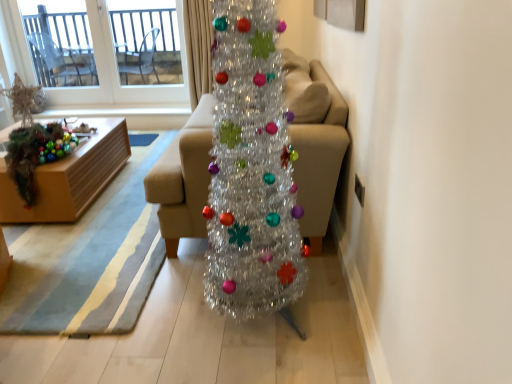
Question: From a real-world perspective, does transparent glass door at upper left sit lower than shiny metallic christmas tree at center?

Choices:
 (A) no
 (B) yes

Answer: (A)

Question: Is transparent glass door at upper left to the left of shiny metallic christmas tree at center from the viewer's perspective?

Choices:
 (A) yes
 (B) no

Answer: (A)

Question: Can you confirm if transparent glass door at upper left is wider than shiny metallic christmas tree at center?

Choices:
 (A) yes
 (B) no

Answer: (B)

Question: Is transparent glass door at upper left oriented away from shiny metallic christmas tree at center?

Choices:
 (A) yes
 (B) no

Answer: (B)

Question: Does transparent glass door at upper left have a larger size compared to shiny metallic christmas tree at center?

Choices:
 (A) no
 (B) yes

Answer: (A)

Question: Is shiny metallic christmas tree at center a part of transparent glass door at upper left?

Choices:
 (A) yes
 (B) no

Answer: (B)

Question: Can you confirm if transparent glass door at upper left is positioned to the left of shiny beige curtain at upper center?

Choices:
 (A) no
 (B) yes

Answer: (B)

Question: Does transparent glass door at upper left have a lesser height compared to shiny beige curtain at upper center?

Choices:
 (A) yes
 (B) no

Answer: (A)

Question: From a real-world perspective, is transparent glass door at upper left under shiny beige curtain at upper center?

Choices:
 (A) yes
 (B) no

Answer: (B)

Question: Considering the relative sizes of transparent glass door at upper left and shiny beige curtain at upper center in the image provided, is transparent glass door at upper left smaller than shiny beige curtain at upper center?

Choices:
 (A) no
 (B) yes

Answer: (B)

Question: Is transparent glass door at upper left taller than shiny beige curtain at upper center?

Choices:
 (A) no
 (B) yes

Answer: (A)

Question: Is transparent glass door at upper left aimed at shiny beige curtain at upper center?

Choices:
 (A) yes
 (B) no

Answer: (B)

Question: From the image's perspective, is transparent glass window at upper left on shiny beige curtain at upper center?

Choices:
 (A) no
 (B) yes

Answer: (B)